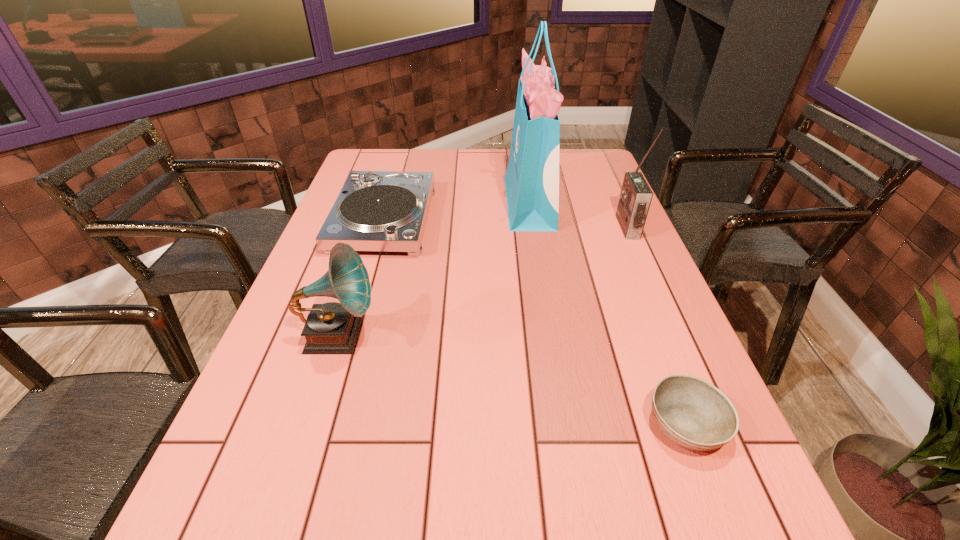
Locate an element on the screen. Image resolution: width=960 pixels, height=540 pixels. free space that is in between the shopping bag and the nearest object is located at coordinates (608, 313).

This screenshot has height=540, width=960. I want to click on free space between the bowl and the record player, so click(x=535, y=322).

Identify the location of vacant area between the shopping bag and the third tallest object. (434, 269).

I want to click on free space between the record player and the nearest object, so click(535, 322).

This screenshot has width=960, height=540. Find the location of `vacant region between the nearest object and the record player`. vacant region between the nearest object and the record player is located at coordinates (535, 322).

Locate which object ranks in proximity to the second tallest object. Please provide its 2D coordinates. Your answer should be formatted as a tuple, i.e. [(x, y)], where the tuple contains the x and y coordinates of a point satisfying the conditions above.

[(532, 178)]

Choose which object is the second nearest neighbor to the shortest object. Please provide its 2D coordinates. Your answer should be formatted as a tuple, i.e. [(x, y)], where the tuple contains the x and y coordinates of a point satisfying the conditions above.

[(532, 178)]

I want to click on vacant region that satisfies the following two spatial constraints: 1. on the back side of the fourth tallest object; 2. on the right side of the third object from left to right, so click(x=389, y=202).

Find the location of a particular element. The width and height of the screenshot is (960, 540). vacant area in the image that satisfies the following two spatial constraints: 1. on the back side of the bowl; 2. from the horn of the second nearest object is located at coordinates point(652,336).